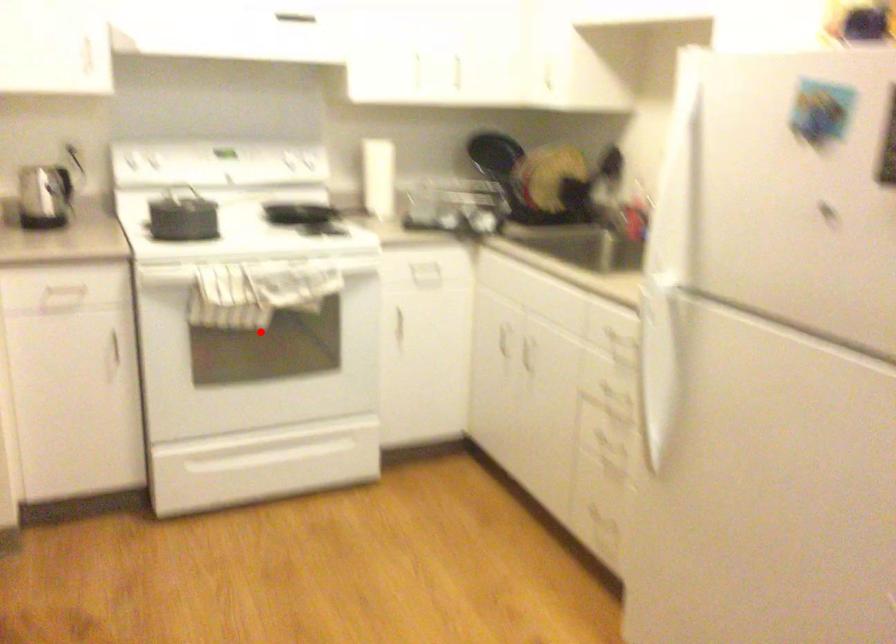
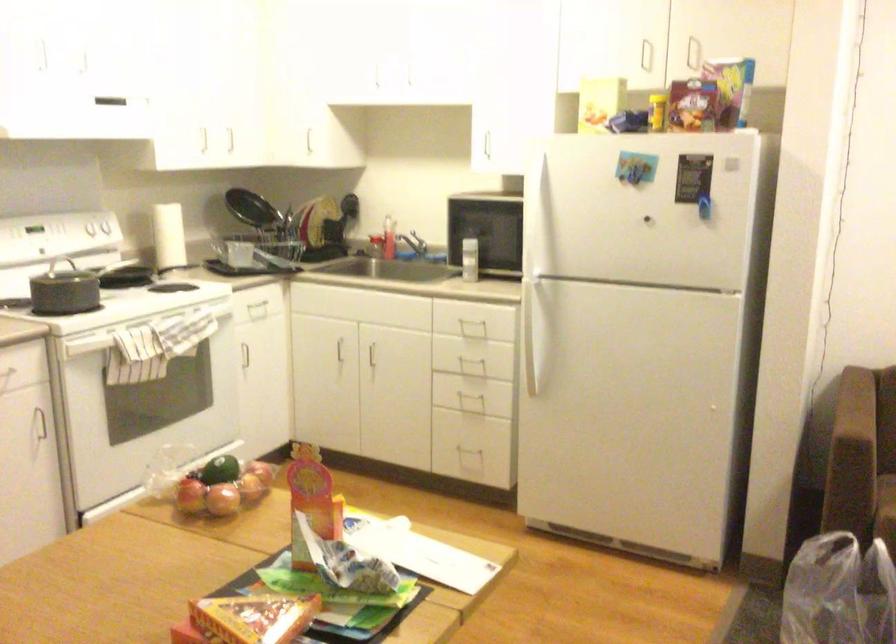
Where in the second image is the point corresponding to the highlighted location from the first image?

(174, 382)